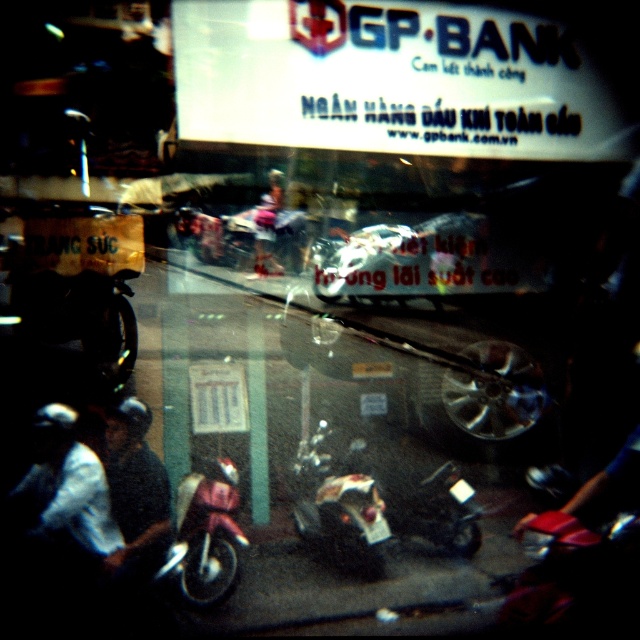
What do you see at coordinates (387, 515) in the screenshot? This screenshot has height=640, width=640. I see `shiny chrome motorcycle at center` at bounding box center [387, 515].

Between shiny chrome motorcycle at center and matte pink helmet at center, which one has more height?

shiny chrome motorcycle at center is taller.

Which is behind, point (369, 522) or point (257, 230)?

Point (257, 230)

The width and height of the screenshot is (640, 640). I want to click on shiny chrome motorcycle at center, so click(387, 515).